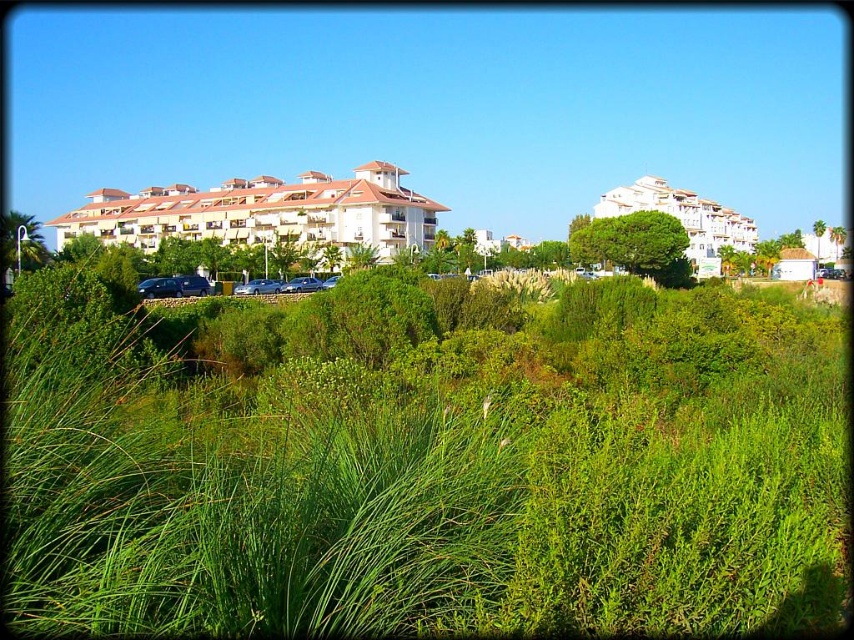
Is green leafy tree at upper right to the left of green leafy palm at left from the viewer's perspective?

No, green leafy tree at upper right is not to the left of green leafy palm at left.

Is point (607, 244) positioned behind point (31, 268)?

No, it is not.

Identify the location of green leafy tree at upper right. Image resolution: width=854 pixels, height=640 pixels. (635, 244).

Where is `green leafy tree at upper right`? This screenshot has width=854, height=640. green leafy tree at upper right is located at coordinates (635, 244).

Who is positioned more to the left, white matte building at center or white matte building at upper right?

Positioned to the left is white matte building at center.

The width and height of the screenshot is (854, 640). I want to click on white matte building at center, so click(x=265, y=212).

What do you see at coordinates (265, 212) in the screenshot? The height and width of the screenshot is (640, 854). I see `white matte building at center` at bounding box center [265, 212].

Find the location of a particular element. The height and width of the screenshot is (640, 854). white matte building at center is located at coordinates (265, 212).

Between green leafy grass at center and green leafy tree at upper right, which one is positioned lower?

green leafy grass at center

Who is taller, green leafy grass at center or green leafy tree at upper right?

green leafy tree at upper right

Is point (609, 577) more distant than point (619, 243)?

No, it is not.

At what (x,y) coordinates should I click in order to perform the action: click on green leafy grass at center. Please return your answer as a coordinate pair (x, y). This screenshot has height=640, width=854. Looking at the image, I should click on (451, 486).